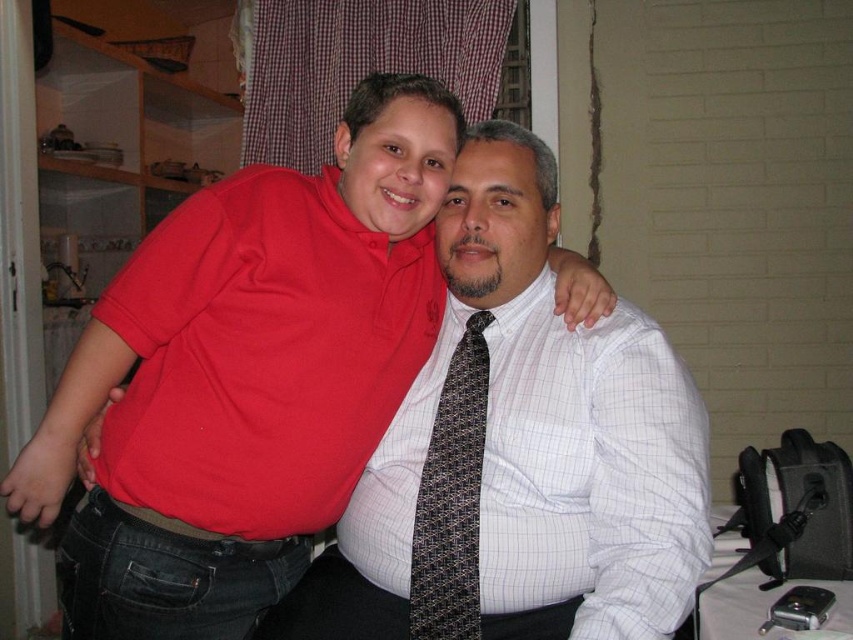
You are a tailor measuring the space between two items in a photo. The items are the matte white shirt at center and the black textured tie at center. The tailor needs to ensure there is at least 10 inches of space between them for proper fitting adjustments. Can the tailor proceed with the current spacing?

The distance between the matte white shirt at center and the black textured tie at center is 10.62 inches, which exceeds the required 10 inches. The tailor can proceed with the current spacing.

You are standing in the room and want to hand a document to the person wearing the matte white shirt at center. Which direction should you move to reach them?

The matte white shirt at center is located at point [247,376], so you should move towards the center of the room to reach them.

Please describe the location of the white checkered dress shirt at center in the image using coordinates. The coordinate system has the origin at the bottom left corner of the image, with x increasing to the right and y increasing upwards. The maximum x and y values are both 1.0. Please provide the coordinates as a tuple in the format of point. 0.738, 0.693.

The white checkered dress shirt at center is located at point (590,472).